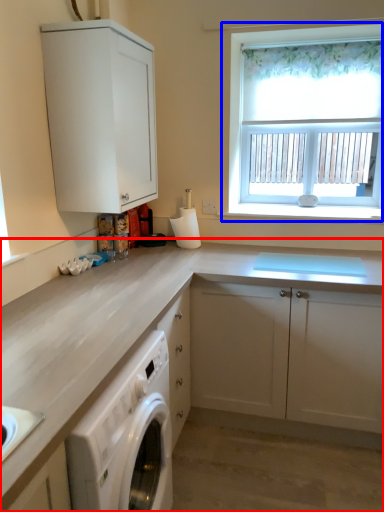
Question: Which object appears closest to the camera in this image, cabinetry (highlighted by a red box) or window (highlighted by a blue box)?

Choices:
 (A) cabinetry
 (B) window

Answer: (A)